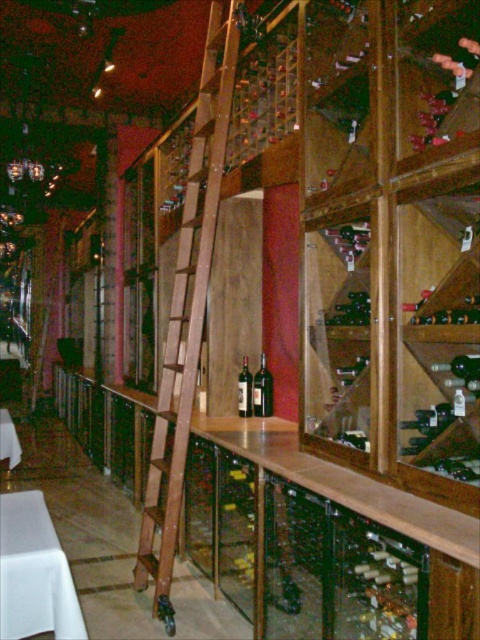
Question: Based on their relative distances, which object is nearer to the white fabric table at lower left?

Choices:
 (A) dark glass bottle at center
 (B) white cloth table at lower left

Answer: (A)

Question: Which of the following is the farthest from the observer?

Choices:
 (A) pyautogui.click(x=264, y=371)
 (B) pyautogui.click(x=11, y=586)
 (C) pyautogui.click(x=421, y=104)
 (D) pyautogui.click(x=1, y=458)

Answer: (D)

Question: Which object is farther from the camera taking this photo?

Choices:
 (A) white cloth table at lower left
 (B) white fabric table at lower left

Answer: (B)

Question: In this image, where is brown wooden ladder at center located relative to white cloth table at lower left?

Choices:
 (A) right
 (B) left

Answer: (A)

Question: From the image, what is the correct spatial relationship of wooden wine rack at center in relation to white fabric table at lower left?

Choices:
 (A) above
 (B) below

Answer: (A)

Question: In this image, where is wooden wine rack at center located relative to dark red glass bottle at center?

Choices:
 (A) above
 (B) below

Answer: (A)